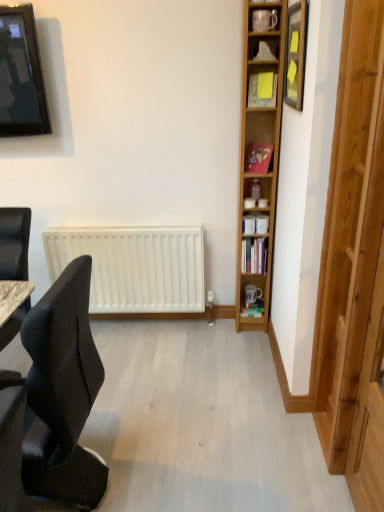
Question: Is transparent wooden door at right not inside hardcover book at center?

Choices:
 (A) yes
 (B) no

Answer: (A)

Question: Is transparent wooden door at right taller than hardcover book at center?

Choices:
 (A) yes
 (B) no

Answer: (A)

Question: Is transparent wooden door at right oriented towards hardcover book at center?

Choices:
 (A) yes
 (B) no

Answer: (B)

Question: Are transparent wooden door at right and hardcover book at center making contact?

Choices:
 (A) no
 (B) yes

Answer: (A)

Question: Is transparent wooden door at right bigger than hardcover book at center?

Choices:
 (A) no
 (B) yes

Answer: (B)

Question: Is hardcover book at center a part of transparent wooden door at right?

Choices:
 (A) yes
 (B) no

Answer: (B)

Question: Is wooden picture frame at upper right located outside black fabric chair at left?

Choices:
 (A) no
 (B) yes

Answer: (B)

Question: From a real-world perspective, is wooden picture frame at upper right positioned under black fabric chair at left based on gravity?

Choices:
 (A) yes
 (B) no

Answer: (B)

Question: Considering the relative sizes of wooden picture frame at upper right and black fabric chair at left in the image provided, is wooden picture frame at upper right shorter than black fabric chair at left?

Choices:
 (A) yes
 (B) no

Answer: (A)

Question: Can you confirm if wooden picture frame at upper right is bigger than black fabric chair at left?

Choices:
 (A) no
 (B) yes

Answer: (A)

Question: Considering the relative sizes of wooden picture frame at upper right and black fabric chair at left in the image provided, is wooden picture frame at upper right taller than black fabric chair at left?

Choices:
 (A) no
 (B) yes

Answer: (A)

Question: Is wooden picture frame at upper right not near black fabric chair at left?

Choices:
 (A) no
 (B) yes

Answer: (B)

Question: Is transparent wooden door at right surrounding black fabric chair at left?

Choices:
 (A) yes
 (B) no

Answer: (B)